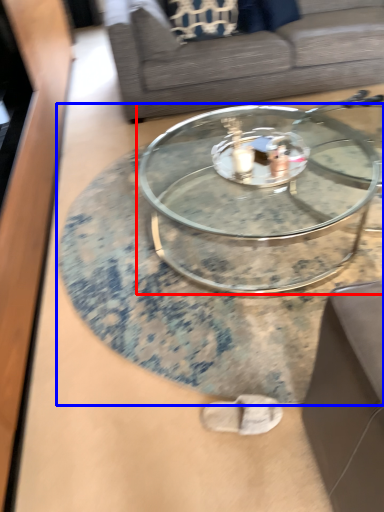
Question: Which object appears closest to the camera in this image, coffee table (highlighted by a red box) or coffee table (highlighted by a blue box)?

Choices:
 (A) coffee table
 (B) coffee table

Answer: (B)